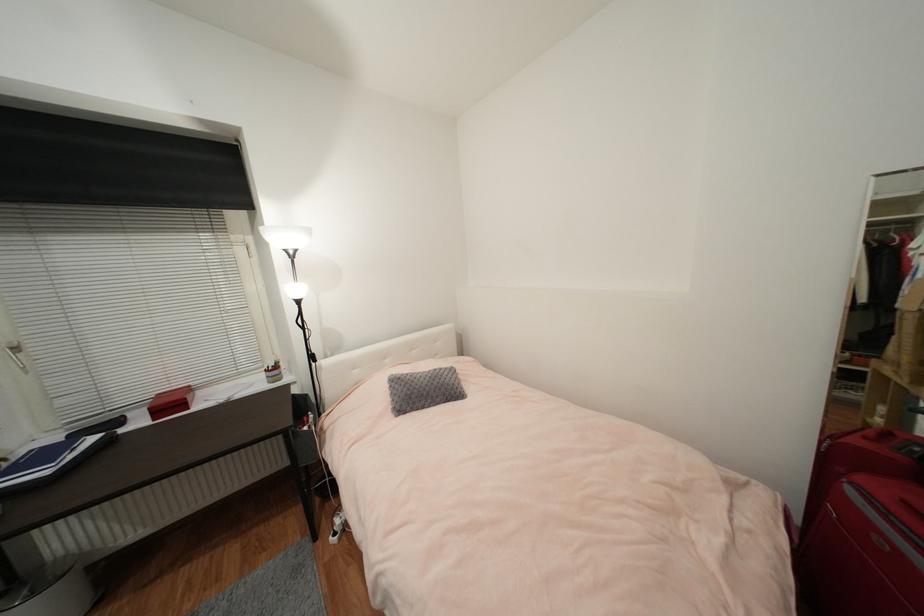
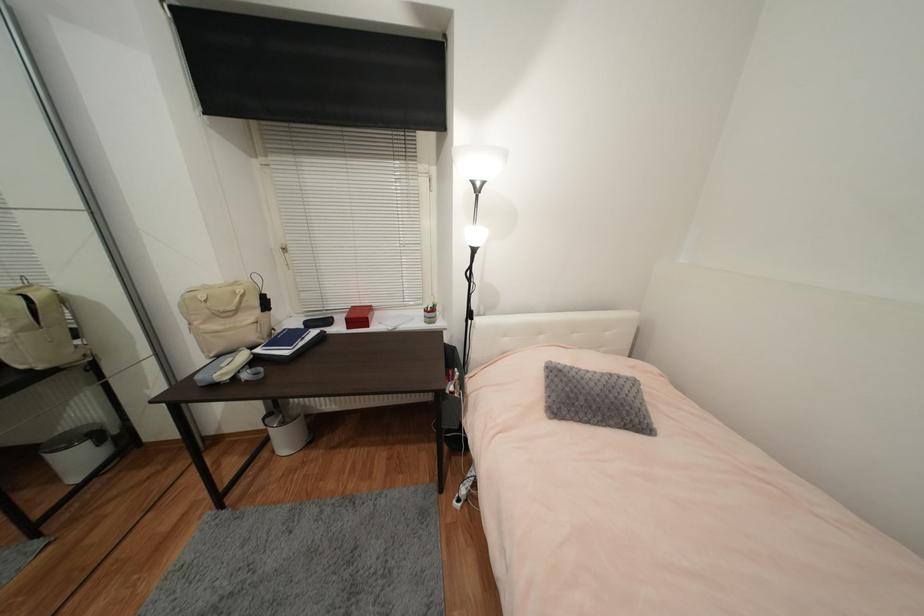
Locate, in the second image, the point that corresponds to (x=176, y=405) in the first image.

(363, 318)